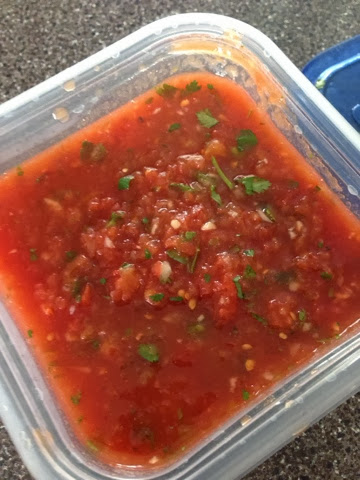
Locate an element on the screen. This screenshot has height=480, width=360. countertop is located at coordinates (322, 457), (13, 469), (267, 10).